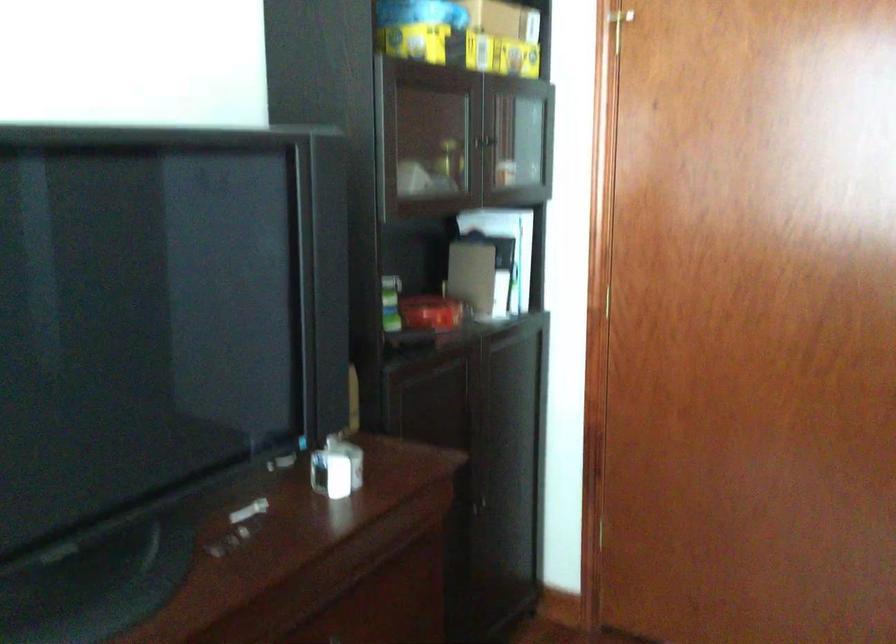
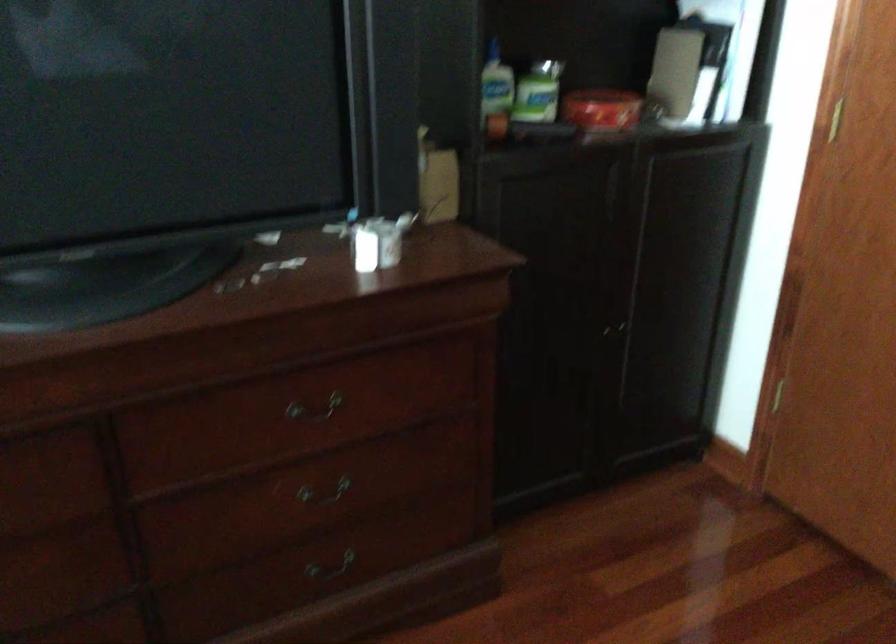
The point at [437,315] is marked in the first image. Where is the corresponding point in the second image?

(600, 109)